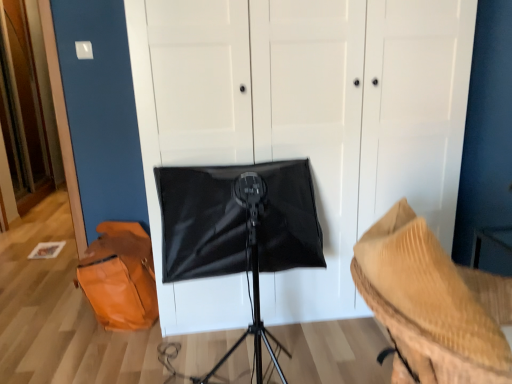
Question: Can you confirm if rippled beige fabric at lower right is positioned to the left of orange leather messenger bag at lower left?

Choices:
 (A) yes
 (B) no

Answer: (B)

Question: Is rippled beige fabric at lower right closer to camera compared to orange leather messenger bag at lower left?

Choices:
 (A) no
 (B) yes

Answer: (B)

Question: Considering the relative sizes of rippled beige fabric at lower right and orange leather messenger bag at lower left in the image provided, is rippled beige fabric at lower right bigger than orange leather messenger bag at lower left?

Choices:
 (A) no
 (B) yes

Answer: (B)

Question: Can we say rippled beige fabric at lower right lies outside orange leather messenger bag at lower left?

Choices:
 (A) no
 (B) yes

Answer: (B)

Question: Is rippled beige fabric at lower right wider than orange leather messenger bag at lower left?

Choices:
 (A) yes
 (B) no

Answer: (A)

Question: Would you say black matte softbox at center is inside or outside rippled beige fabric at lower right?

Choices:
 (A) outside
 (B) inside

Answer: (A)

Question: In terms of size, does black matte softbox at center appear bigger or smaller than rippled beige fabric at lower right?

Choices:
 (A) small
 (B) big

Answer: (B)

Question: From the image's perspective, is black matte softbox at center located above or below rippled beige fabric at lower right?

Choices:
 (A) below
 (B) above

Answer: (B)

Question: Is black matte softbox at center in front of or behind rippled beige fabric at lower right in the image?

Choices:
 (A) front
 (B) behind

Answer: (B)

Question: Visually, is orange leather messenger bag at lower left positioned to the left or to the right of black matte softbox at center?

Choices:
 (A) right
 (B) left

Answer: (B)

Question: In terms of width, does orange leather messenger bag at lower left look wider or thinner when compared to black matte softbox at center?

Choices:
 (A) thin
 (B) wide

Answer: (A)

Question: Would you say orange leather messenger bag at lower left is inside or outside black matte softbox at center?

Choices:
 (A) inside
 (B) outside

Answer: (B)

Question: From a real-world perspective, is orange leather messenger bag at lower left positioned above or below black matte softbox at center?

Choices:
 (A) below
 (B) above

Answer: (A)

Question: In terms of width, does black matte softbox at center look wider or thinner when compared to orange leather messenger bag at lower left?

Choices:
 (A) thin
 (B) wide

Answer: (B)

Question: Is black matte softbox at center situated inside orange leather messenger bag at lower left or outside?

Choices:
 (A) inside
 (B) outside

Answer: (B)